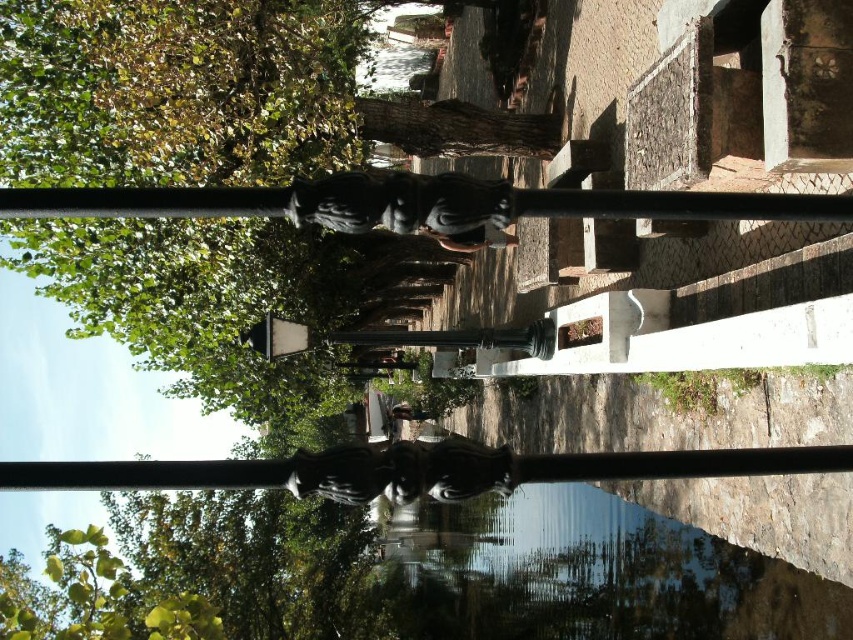
You are standing in the park and see the green leafy tree at upper left and the glossy black statue at center. Which object is located above the other?

The green leafy tree at upper left is positioned over the glossy black statue at center.

You are standing at the center of the pathway between the two points, point (380, 504) and point (293, 461). Which point is closer to you?

Point (293, 461) is closer to you because it is nearer than point (380, 504), which is further away.